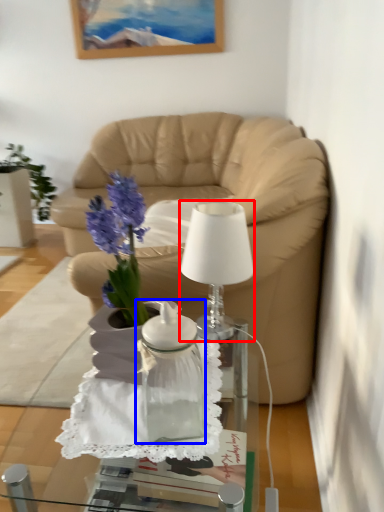
Question: Among these objects, which one is nearest to the camera, lamp (highlighted by a red box) or vase (highlighted by a blue box)?

Choices:
 (A) lamp
 (B) vase

Answer: (B)